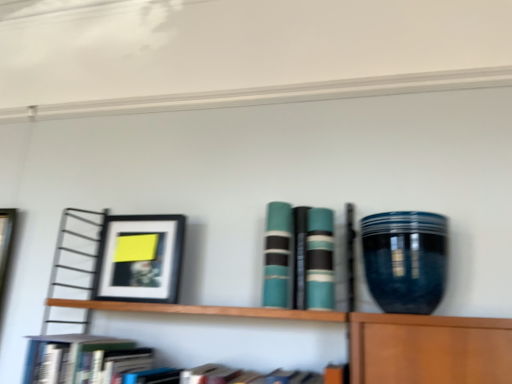
Question: Is teal matte book at center, the second book in the left-to-right sequence, completely or partially inside teal matte book at center, which ranks as the first book in right-to-left order?

Choices:
 (A) no
 (B) yes

Answer: (A)

Question: From a real-world perspective, is teal matte book at center, which ranks as the first book in right-to-left order, on top of teal matte book at center, the third book from the right?

Choices:
 (A) no
 (B) yes

Answer: (A)

Question: Is teal matte book at center, the 4th book positioned from the left, smaller than teal matte book at center, the second book in the left-to-right sequence?

Choices:
 (A) yes
 (B) no

Answer: (A)

Question: Does teal matte book at center, the 4th book positioned from the left, come in front of teal matte book at center, the second book in the left-to-right sequence?

Choices:
 (A) no
 (B) yes

Answer: (B)

Question: Is teal matte book at center, which ranks as the first book in right-to-left order, oriented towards teal matte book at center, the third book from the right?

Choices:
 (A) yes
 (B) no

Answer: (B)

Question: From a real-world perspective, is teal matte book at center, the 4th book positioned from the left, located beneath teal matte book at center, the third book from the right?

Choices:
 (A) yes
 (B) no

Answer: (A)

Question: Could you tell me if teal matte book at center, which ranks as the first book in right-to-left order, is turned towards teal matte book at center, the third book positioned from the left?

Choices:
 (A) no
 (B) yes

Answer: (A)

Question: From a real-world perspective, is teal matte book at center, the 4th book positioned from the left, below teal matte book at center, the third book positioned from the left?

Choices:
 (A) no
 (B) yes

Answer: (A)

Question: Is teal matte book at center, the 4th book positioned from the left, shorter than teal matte book at center, the 2th book in the right-to-left sequence?

Choices:
 (A) yes
 (B) no

Answer: (A)

Question: Is teal matte book at center, the 4th book positioned from the left, located outside teal matte book at center, the third book positioned from the left?

Choices:
 (A) no
 (B) yes

Answer: (B)

Question: Does teal matte book at center, the 4th book positioned from the left, have a lesser width compared to teal matte book at center, the 2th book in the right-to-left sequence?

Choices:
 (A) no
 (B) yes

Answer: (B)

Question: Considering the relative positions of teal matte book at center, which ranks as the first book in right-to-left order, and teal matte book at center, the 2th book in the right-to-left sequence, in the image provided, is teal matte book at center, which ranks as the first book in right-to-left order, to the left of teal matte book at center, the 2th book in the right-to-left sequence, from the viewer's perspective?

Choices:
 (A) yes
 (B) no

Answer: (B)

Question: Is teal matte book at center, the 2th book in the right-to-left sequence, behind matte black picture frame at left?

Choices:
 (A) yes
 (B) no

Answer: (B)